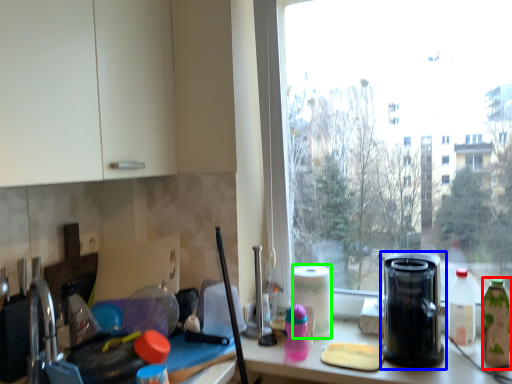
Question: Considering the real-world distances, which object is closest to bottle (highlighted by a red box)? kitchen appliance (highlighted by a blue box) or paper towel (highlighted by a green box).

Choices:
 (A) kitchen appliance
 (B) paper towel

Answer: (A)